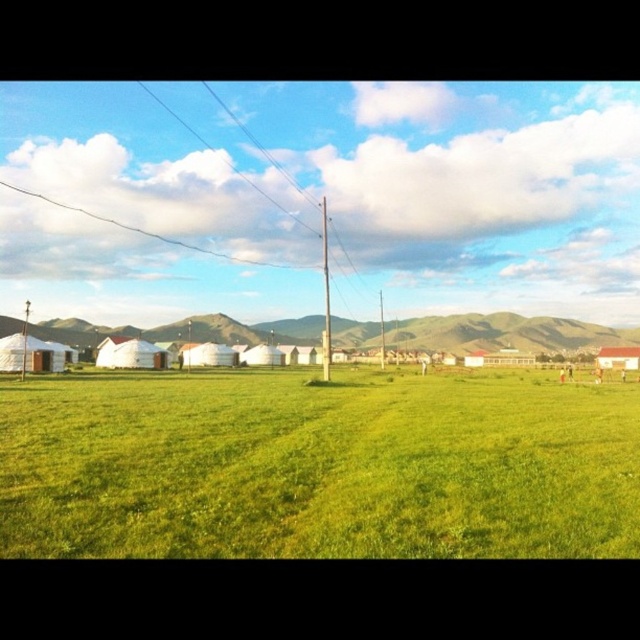
Does green grassy field at center have a lesser height compared to white fabric tent at center?

Indeed, green grassy field at center has a lesser height compared to white fabric tent at center.

Is green grassy field at center closer to the viewer compared to white fabric tent at center?

Yes, green grassy field at center is closer to the viewer.

Does point (552, 445) come farther from viewer compared to point (122, 348)?

No, it is in front of (122, 348).

This screenshot has width=640, height=640. Identify the location of green grassy field at center. (317, 467).

This screenshot has width=640, height=640. In order to click on green grassy field at lower center in this screenshot , I will do `click(504, 333)`.

Is green grassy field at lower center smaller than white matte hut at lower right?

Actually, green grassy field at lower center might be larger than white matte hut at lower right.

Find the location of `green grassy field at lower center`. green grassy field at lower center is located at coordinates (504, 333).

Find the location of `green grassy field at lower center`. green grassy field at lower center is located at coordinates (504, 333).

Who is more distant from viewer, (134, 346) or (609, 356)?

Point (609, 356)

Find the location of a particular element. This screenshot has height=640, width=640. white fabric tent at center is located at coordinates [x=129, y=353].